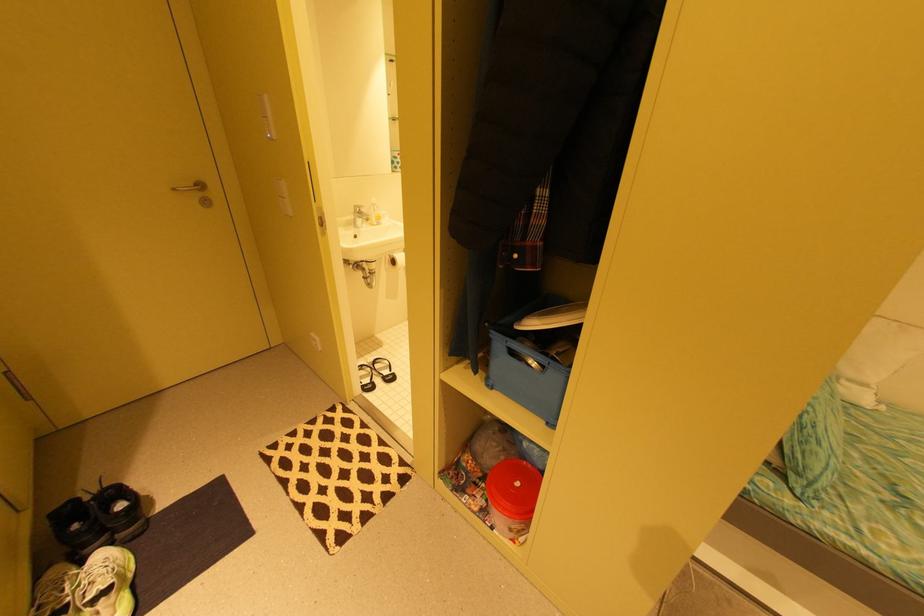
Find where to turn the faucet handle. Please return your answer as a coordinate pair (x, y).

(360, 215)